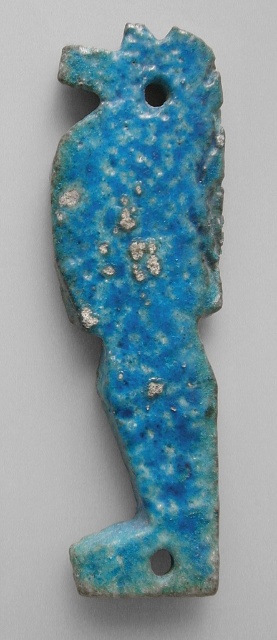
Who is more forward, (129, 593) or (157, 81)?

Point (129, 593) is in front.

Is point (211, 164) positioned before point (152, 92)?

No.

Find the location of a particular element. blue speckled stone fish at center is located at coordinates (147, 296).

Is point (158, 100) in front of point (152, 554)?

That is False.

Is smooth blue hole at upper center taller than blue speckled stone hole at center?

Yes.

Where is `smooth blue hole at upper center`? Image resolution: width=277 pixels, height=640 pixels. smooth blue hole at upper center is located at coordinates (155, 92).

Measure the distance from blue speckled stone fish at center to blue speckled stone hole at center.

14.92 inches

Which is in front, point (90, 572) or point (160, 557)?

Point (90, 572) is more forward.

Find the location of a particular element. The width and height of the screenshot is (277, 640). blue speckled stone fish at center is located at coordinates (147, 296).